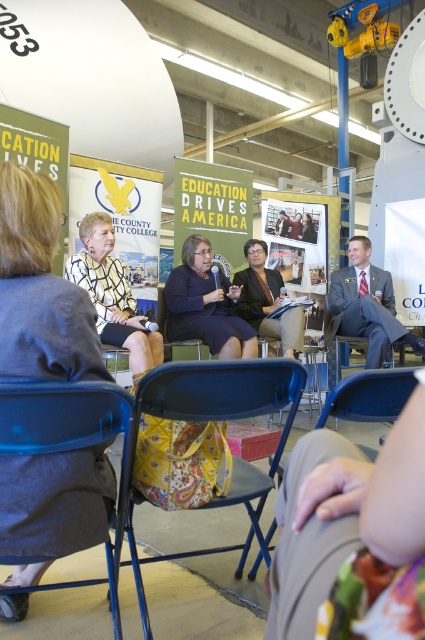
This screenshot has width=425, height=640. I want to click on matte black dress at center, so click(206, 305).

Is patterned fabric dress at center to the left of matte black dress at center from the viewer's perspective?

Indeed, patterned fabric dress at center is positioned on the left side of matte black dress at center.

Is patterned fabric dress at center further to the viewer compared to matte black dress at center?

No, it is not.

Does point (85, 305) come in front of point (249, 346)?

Yes, point (85, 305) is in front of point (249, 346).

You are a GUI agent. You are given a task and a screenshot of the screen. Output one action in this format:
    pyautogui.click(x=<x>, y=<y>)
    Task: Click on the patterned fabric dress at center
    The image size is (425, 640).
    Given the screenshot: What is the action you would take?
    pyautogui.click(x=39, y=289)

Who is more distant from viewer, (285, 371) or (356, 412)?

The point (356, 412) is more distant.

Does blue metal chair at center lie behind blue fabric chair at center?

Yes, blue metal chair at center is further from the viewer.

Does point (263, 401) come closer to viewer compared to point (320, 426)?

No, (263, 401) is behind (320, 426).

Find the location of a particular element. blue metal chair at center is located at coordinates click(x=221, y=419).